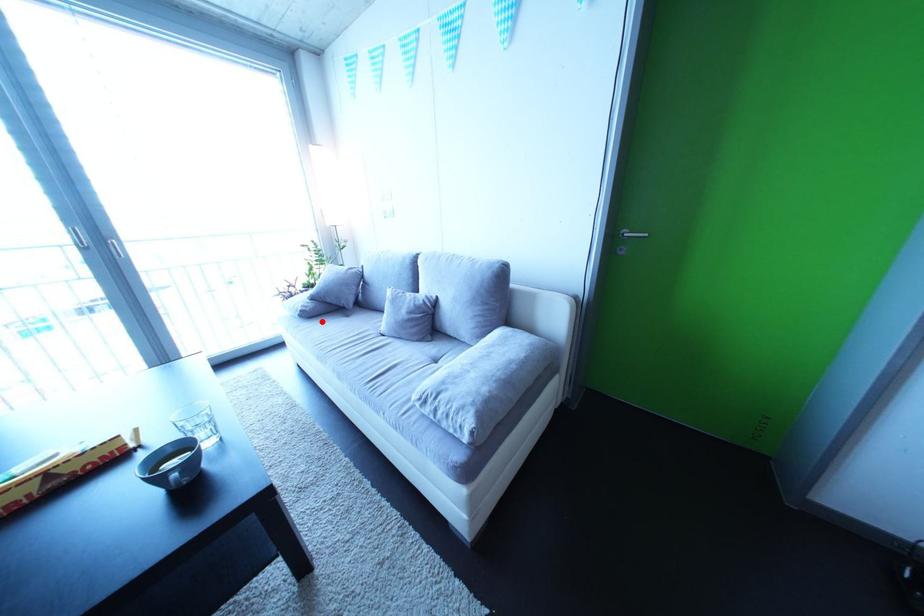
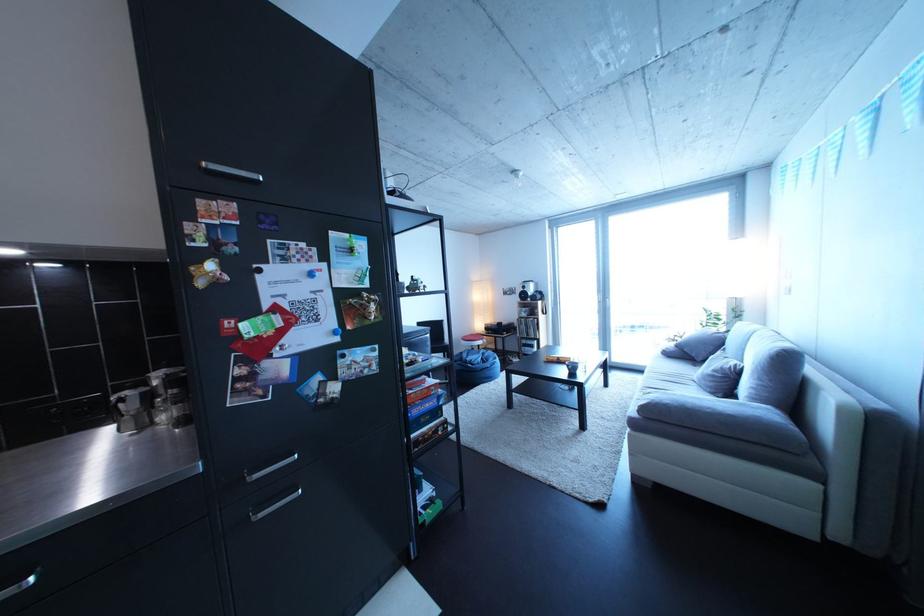
Locate, in the second image, the point that corresponds to the highlighted location in the first image.

(682, 361)